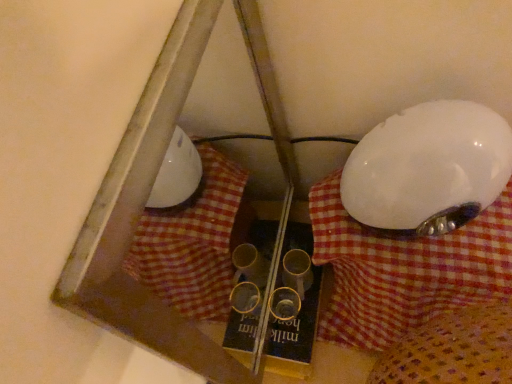
Question: In terms of size, does white checkered fabric at center appear bigger or smaller than white glossy lampshade at right?

Choices:
 (A) big
 (B) small

Answer: (A)

Question: From the image's perspective, is white checkered fabric at center above or below white glossy lampshade at right?

Choices:
 (A) below
 (B) above

Answer: (A)

Question: Which of these objects is positioned farthest from the white checkered fabric at center?

Choices:
 (A) white glossy lampshade at right
 (B) yellow cardboard book at center

Answer: (B)

Question: Based on their relative distances, which object is nearer to the yellow cardboard book at center?

Choices:
 (A) white glossy lampshade at right
 (B) white checkered fabric at center

Answer: (B)